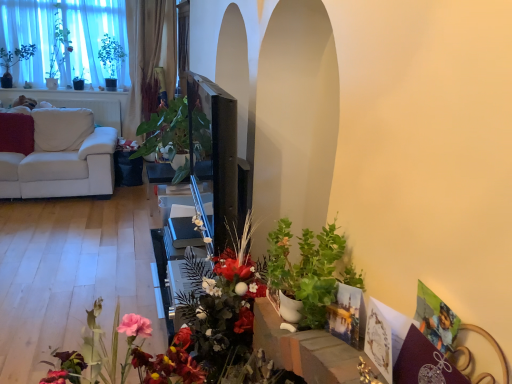
Question: Are white fabric couch at left and green glossy plant at center, the second houseplant viewed from the front, located far from each other?

Choices:
 (A) yes
 (B) no

Answer: (B)

Question: From the image's perspective, is white fabric couch at left above green glossy plant at center, which is the 1th houseplant in top-to-bottom order?

Choices:
 (A) yes
 (B) no

Answer: (B)

Question: Would you say white fabric couch at left is outside green glossy plant at center, the first houseplant viewed from the back?

Choices:
 (A) yes
 (B) no

Answer: (A)

Question: Could green glossy plant at center, which is the 1th houseplant in top-to-bottom order, be considered to be inside white fabric couch at left?

Choices:
 (A) yes
 (B) no

Answer: (B)

Question: Does white fabric couch at left have a lesser width compared to green glossy plant at center, which is the first houseplant in left-to-right order?

Choices:
 (A) no
 (B) yes

Answer: (A)

Question: From the image's perspective, is white fabric couch at left under green glossy plant at center, the first houseplant viewed from the back?

Choices:
 (A) yes
 (B) no

Answer: (A)

Question: Considering the relative sizes of green matte plant at lower right, which is the first houseplant from bottom to top, and green matte plant at upper left in the image provided, is green matte plant at lower right, which is the first houseplant from bottom to top, shorter than green matte plant at upper left?

Choices:
 (A) yes
 (B) no

Answer: (A)

Question: Is green matte plant at lower right, positioned as the second houseplant in top-to-bottom order, looking in the opposite direction of green matte plant at upper left?

Choices:
 (A) no
 (B) yes

Answer: (A)

Question: Is there a large distance between green matte plant at lower right, which is the first houseplant from bottom to top, and green matte plant at upper left?

Choices:
 (A) yes
 (B) no

Answer: (A)

Question: From the image's perspective, is green matte plant at lower right, marked as the second houseplant in a left-to-right arrangement, located above green matte plant at upper left?

Choices:
 (A) no
 (B) yes

Answer: (A)

Question: Is the depth of green matte plant at lower right, positioned as the 1th houseplant in front-to-back order, less than that of green matte plant at upper left?

Choices:
 (A) yes
 (B) no

Answer: (A)

Question: Can you confirm if green matte plant at lower right, which appears as the 1th houseplant when viewed from the right, is smaller than green matte plant at upper left?

Choices:
 (A) yes
 (B) no

Answer: (A)

Question: From a real-world perspective, is green matte plant at lower right, positioned as the second houseplant in top-to-bottom order, over white fabric couch at left?

Choices:
 (A) yes
 (B) no

Answer: (A)